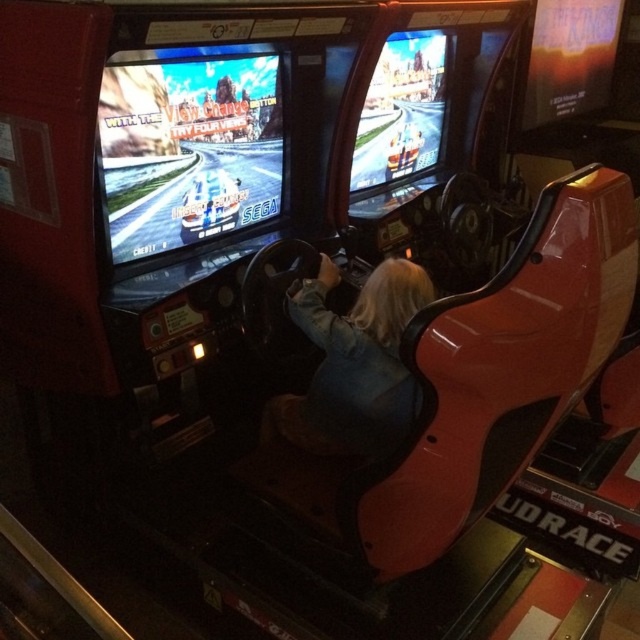
Question: Is shiny plastic screen at center to the right of denim jacket at center from the viewer's perspective?

Choices:
 (A) no
 (B) yes

Answer: (A)

Question: Which point is farther to the camera?

Choices:
 (A) denim jacket at center
 (B) shiny plastic screen at center

Answer: (A)

Question: Is shiny plastic screen at center to the left of denim jacket at center from the viewer's perspective?

Choices:
 (A) no
 (B) yes

Answer: (B)

Question: Which point appears farthest from the camera in this image?

Choices:
 (A) (324, 282)
 (B) (204, 109)

Answer: (A)

Question: Is shiny plastic screen at center positioned behind denim jacket at center?

Choices:
 (A) yes
 (B) no

Answer: (B)

Question: Which point appears closest to the camera in this image?

Choices:
 (A) pyautogui.click(x=134, y=228)
 (B) pyautogui.click(x=384, y=282)

Answer: (B)